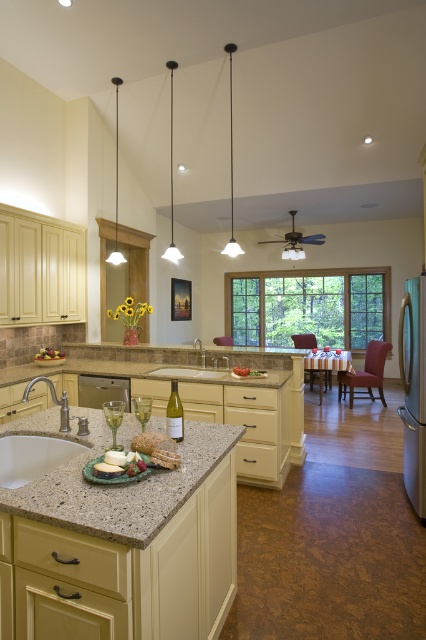
How far apart are brown wood chair at center and brown leather chair at center?

The distance of brown wood chair at center from brown leather chair at center is 6.70 feet.

Can you confirm if brown wood chair at center is taller than brown leather chair at center?

Yes.

Which is behind, point (362, 385) or point (230, 337)?

Positioned behind is point (230, 337).

Where is `brown wood chair at center`? brown wood chair at center is located at coordinates (365, 374).

Is satin stainless steel refrigerator at right shorter than satin nickel dishwasher at center?

Incorrect, satin stainless steel refrigerator at right's height does not fall short of satin nickel dishwasher at center's.

Does point (419, 438) come closer to viewer compared to point (120, 381)?

Yes, it is.

Find the location of a particular element. The image size is (426, 640). satin stainless steel refrigerator at right is located at coordinates (414, 388).

Does white granite sink at center have a lesser width compared to wooden chair at center?

No.

How much distance is there between white granite sink at center and wooden chair at center?

3.78 meters

Describe the element at coordinates (195, 364) in the screenshot. I see `white granite sink at center` at that location.

Find the location of a particular element. The height and width of the screenshot is (640, 426). white granite sink at center is located at coordinates (195, 364).